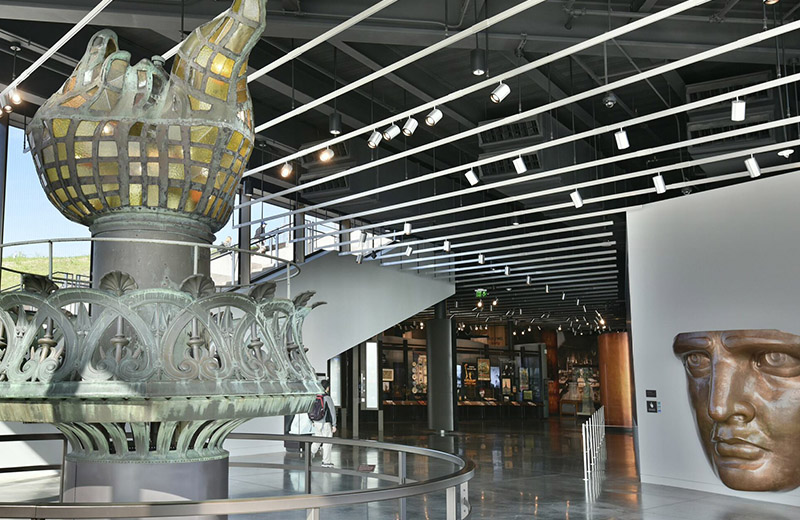
You are a GUI agent. You are given a task and a screenshot of the screen. Output one action in this format:
    pyautogui.click(x=<x>, y=<y>)
    Task: Click on the dividers
    
    Given the screenshot: What is the action you would take?
    pyautogui.click(x=582, y=438), pyautogui.click(x=600, y=428), pyautogui.click(x=610, y=410), pyautogui.click(x=600, y=420), pyautogui.click(x=594, y=432)